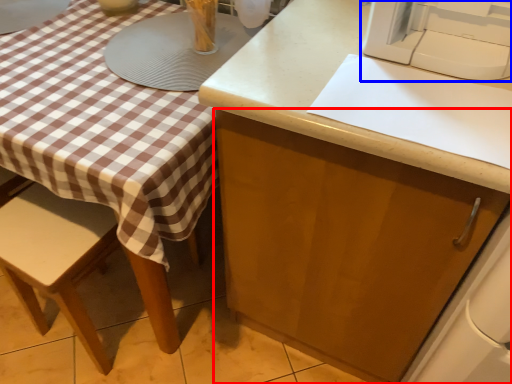
Question: Among these objects, which one is farthest to the camera, cabinetry (highlighted by a red box) or sewing machine (highlighted by a blue box)?

Choices:
 (A) cabinetry
 (B) sewing machine

Answer: (B)